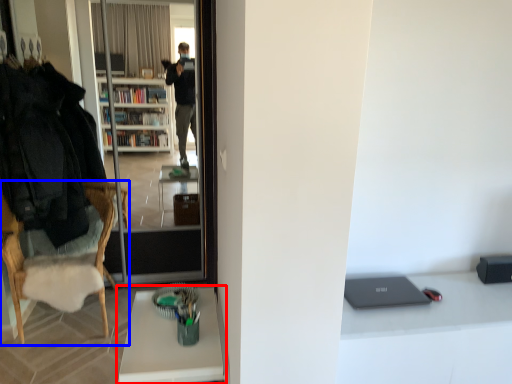
Question: Among these objects, which one is nearest to the camera, desk (highlighted by a red box) or chair (highlighted by a blue box)?

Choices:
 (A) desk
 (B) chair

Answer: (A)